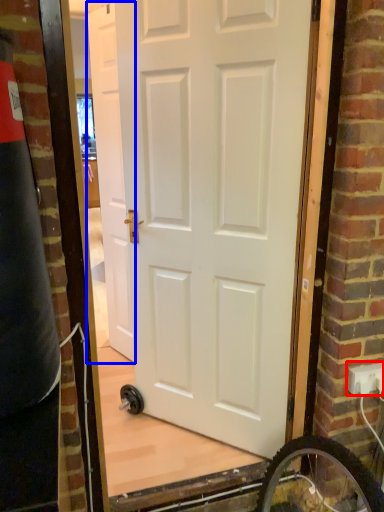
Question: Which of the following is the farthest to the observer, electric outlet (highlighted by a red box) or door (highlighted by a blue box)?

Choices:
 (A) electric outlet
 (B) door

Answer: (B)